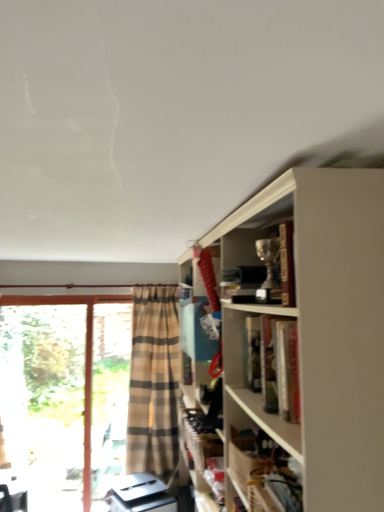
Question: Is wooden shelf at lower right taller than transparent glass door at left?

Choices:
 (A) yes
 (B) no

Answer: (B)

Question: Are wooden shelf at lower right and transparent glass door at left beside each other?

Choices:
 (A) yes
 (B) no

Answer: (B)

Question: Considering the relative sizes of wooden shelf at lower right and transparent glass door at left in the image provided, is wooden shelf at lower right shorter than transparent glass door at left?

Choices:
 (A) yes
 (B) no

Answer: (A)

Question: Would you consider wooden shelf at lower right to be distant from transparent glass door at left?

Choices:
 (A) no
 (B) yes

Answer: (B)

Question: From a real-world perspective, is wooden shelf at lower right positioned under transparent glass door at left based on gravity?

Choices:
 (A) no
 (B) yes

Answer: (A)

Question: Does wooden shelf at lower right appear on the left side of transparent glass door at left?

Choices:
 (A) yes
 (B) no

Answer: (B)

Question: Can you confirm if metallic trophy at upper right is shorter than wooden shelf at lower right?

Choices:
 (A) yes
 (B) no

Answer: (B)

Question: Is metallic trophy at upper right not close to wooden shelf at lower right?

Choices:
 (A) no
 (B) yes

Answer: (A)

Question: Does metallic trophy at upper right have a greater width compared to wooden shelf at lower right?

Choices:
 (A) no
 (B) yes

Answer: (B)

Question: Is metallic trophy at upper right aimed at wooden shelf at lower right?

Choices:
 (A) yes
 (B) no

Answer: (B)

Question: From the image's perspective, is metallic trophy at upper right below wooden shelf at lower right?

Choices:
 (A) yes
 (B) no

Answer: (B)

Question: Is metallic trophy at upper right closer to the viewer compared to wooden shelf at lower right?

Choices:
 (A) no
 (B) yes

Answer: (A)

Question: Is metallic trophy at upper right beside clear glass screen door at left?

Choices:
 (A) yes
 (B) no

Answer: (B)